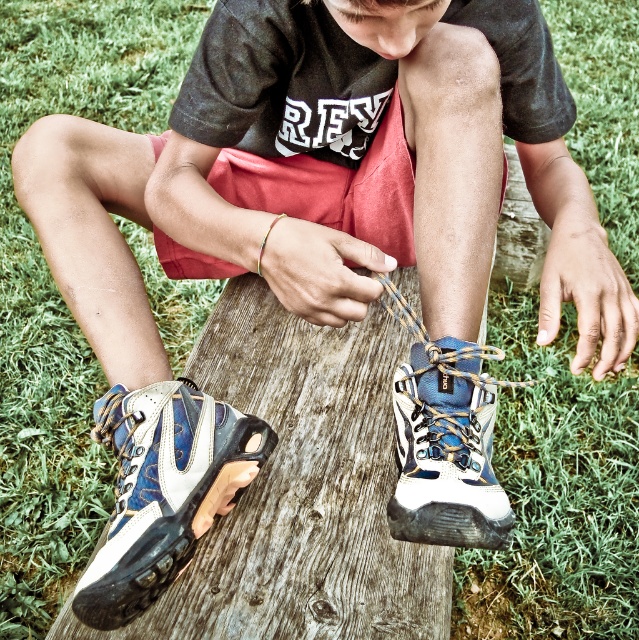
Can you confirm if white leather sneaker at lower center is positioned below blue suede hiking boot at center?

Yes, white leather sneaker at lower center is below blue suede hiking boot at center.

Is white leather sneaker at lower center smaller than blue suede hiking boot at center?

Incorrect, white leather sneaker at lower center is not smaller in size than blue suede hiking boot at center.

Identify the location of white leather sneaker at lower center. This screenshot has width=639, height=640. (164, 490).